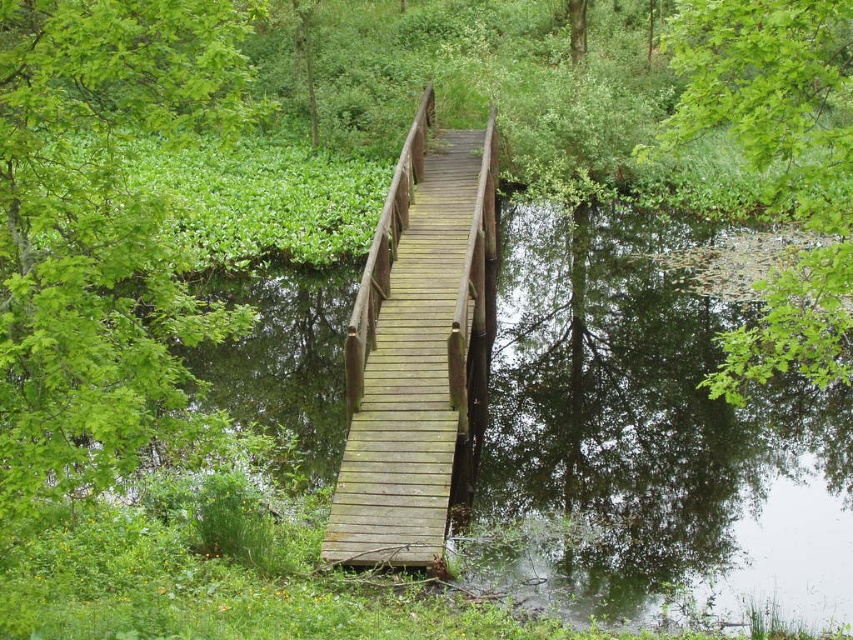
Which is more to the left, green leafy tree at upper left or wooden bridge at center?

Positioned to the left is green leafy tree at upper left.

Looking at this image, does green leafy tree at upper left appear on the right side of wooden bridge at center?

Incorrect, green leafy tree at upper left is not on the right side of wooden bridge at center.

Describe the element at coordinates (97, 225) in the screenshot. This screenshot has width=853, height=640. I see `green leafy tree at upper left` at that location.

At what (x,y) coordinates should I click in order to perform the action: click on green leafy tree at upper left. Please return your answer as a coordinate pair (x, y). The image size is (853, 640). Looking at the image, I should click on (97, 225).

Who is positioned more to the left, green leafy tree at upper left or green leafy tree at upper right?

Positioned to the left is green leafy tree at upper left.

Find the location of a particular element. This screenshot has width=853, height=640. green leafy tree at upper left is located at coordinates (97, 225).

Between wooden bridge at center and green leafy tree at upper right, which one is positioned higher?

green leafy tree at upper right is above.

You are a GUI agent. You are given a task and a screenshot of the screen. Output one action in this format:
    pyautogui.click(x=<x>, y=<y>)
    Task: Click on the wooden bridge at center
    The image size is (853, 640).
    Given the screenshot: What is the action you would take?
    pyautogui.click(x=418, y=352)

You are a GUI agent. You are given a task and a screenshot of the screen. Output one action in this format:
    pyautogui.click(x=<x>, y=<y>)
    Task: Click on the wooden bridge at center
    This screenshot has height=640, width=853.
    Given the screenshot: What is the action you would take?
    pyautogui.click(x=418, y=352)